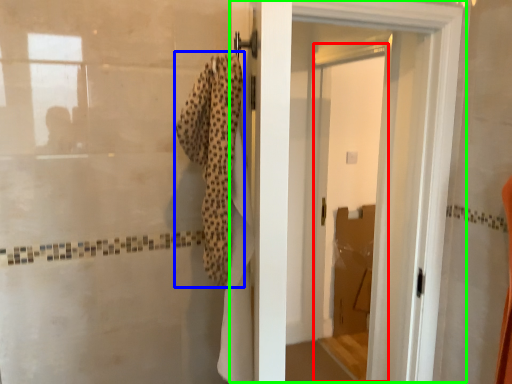
Question: Which is farther away from screen door (highlighted by a red box)? bath towel (highlighted by a blue box) or door (highlighted by a green box)?

Choices:
 (A) bath towel
 (B) door

Answer: (A)